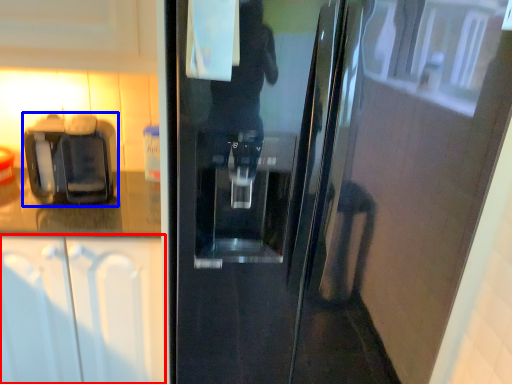
Question: Which of the following is the farthest to the observer, cabinetry (highlighted by a red box) or coffee machine (highlighted by a blue box)?

Choices:
 (A) cabinetry
 (B) coffee machine

Answer: (B)